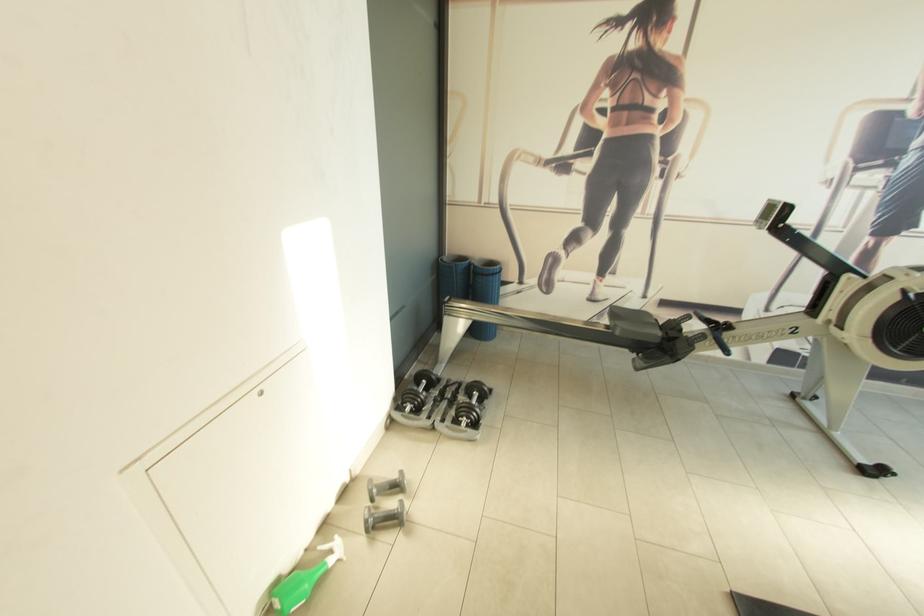
Where is `rowing machine seat`? rowing machine seat is located at coordinates 636,328.